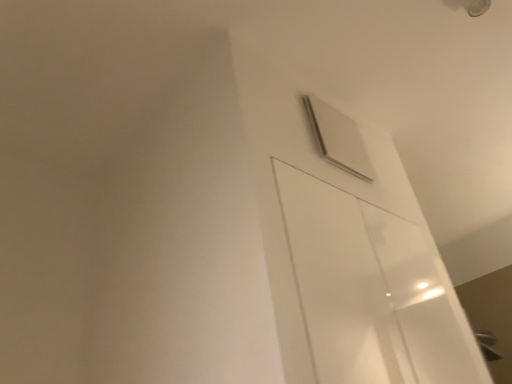
The width and height of the screenshot is (512, 384). Identify the location of silver metallic window at upper center. (338, 138).

The height and width of the screenshot is (384, 512). Describe the element at coordinates (338, 138) in the screenshot. I see `silver metallic window at upper center` at that location.

I want to click on silver metallic window at upper center, so click(338, 138).